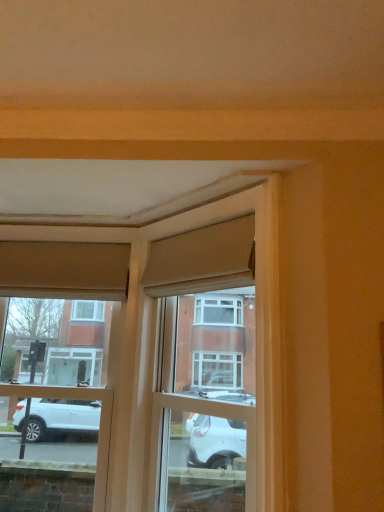
Question: Relative to matte wood window frame at center, is matte beige curtain at upper left, which is the first curtain from left to right, in front or behind?

Choices:
 (A) front
 (B) behind

Answer: (B)

Question: Considering the positions of point (94, 270) and point (276, 278), is point (94, 270) closer or farther from the camera than point (276, 278)?

Choices:
 (A) farther
 (B) closer

Answer: (A)

Question: Estimate the real-world distances between objects in this image. Which object is closer to the matte wood window frame at center?

Choices:
 (A) matte beige curtain at upper left, the 2th curtain viewed from the right
 (B) matte beige curtain at upper center, acting as the 1th curtain starting from the front
 (C) matte glass window at center

Answer: (B)

Question: Which of these objects is positioned farthest from the matte wood window frame at center?

Choices:
 (A) matte beige curtain at upper center, acting as the 1th curtain starting from the front
 (B) matte glass window at center
 (C) matte beige curtain at upper left, marked as the 2th curtain in a front-to-back arrangement

Answer: (B)